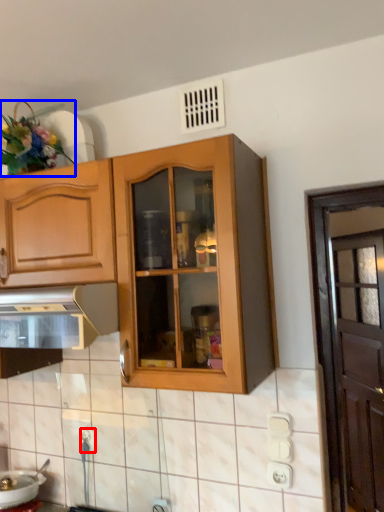
Question: Which of the following is the farthest to the observer, electric outlet (highlighted by a red box) or flower (highlighted by a blue box)?

Choices:
 (A) electric outlet
 (B) flower

Answer: (A)